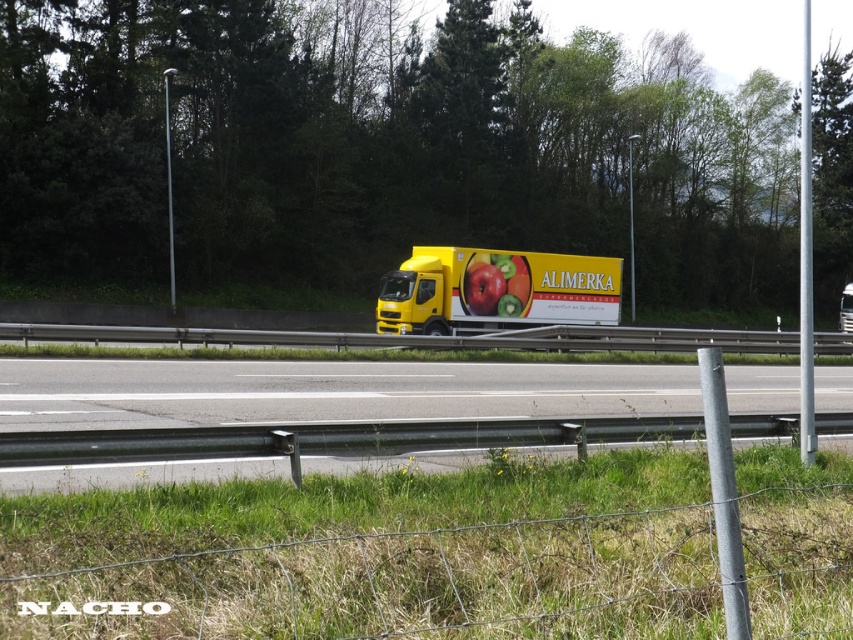
Can you confirm if yellow matte truck at center is shorter than yellow matte trailer truck at center?

Yes.

Who is more forward, (74, 476) or (590, 305)?

Point (74, 476) is more forward.

You are a GUI agent. You are given a task and a screenshot of the screen. Output one action in this format:
    pyautogui.click(x=<x>, y=<y>)
    Task: Click on the yellow matte truck at center
    
    Given the screenshot: What is the action you would take?
    pyautogui.click(x=326, y=392)

Does yellow matte trailer truck at center appear under shiny red apple at center?

Yes, yellow matte trailer truck at center is below shiny red apple at center.

Consider the image. Is yellow matte trailer truck at center further to the viewer compared to shiny red apple at center?

That is False.

Locate an element on the screen. The image size is (853, 640). yellow matte trailer truck at center is located at coordinates pyautogui.click(x=495, y=291).

Identify the location of yellow matte trailer truck at center. The width and height of the screenshot is (853, 640). (495, 291).

Is yellow matte truck at center positioned in front of shiny red apple at center?

Yes.

Is yellow matte truck at center smaller than shiny red apple at center?

Incorrect, yellow matte truck at center is not smaller in size than shiny red apple at center.

Does point (160, 394) come in front of point (515, 292)?

That is True.

At what (x,y) coordinates should I click in order to perform the action: click on yellow matte truck at center. Please return your answer as a coordinate pair (x, y). This screenshot has width=853, height=640. Looking at the image, I should click on (326, 392).